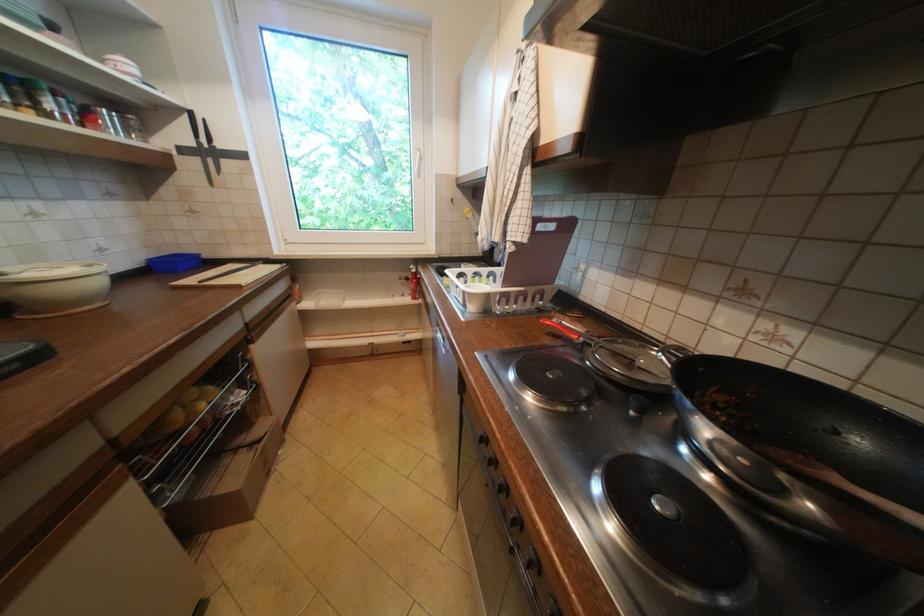
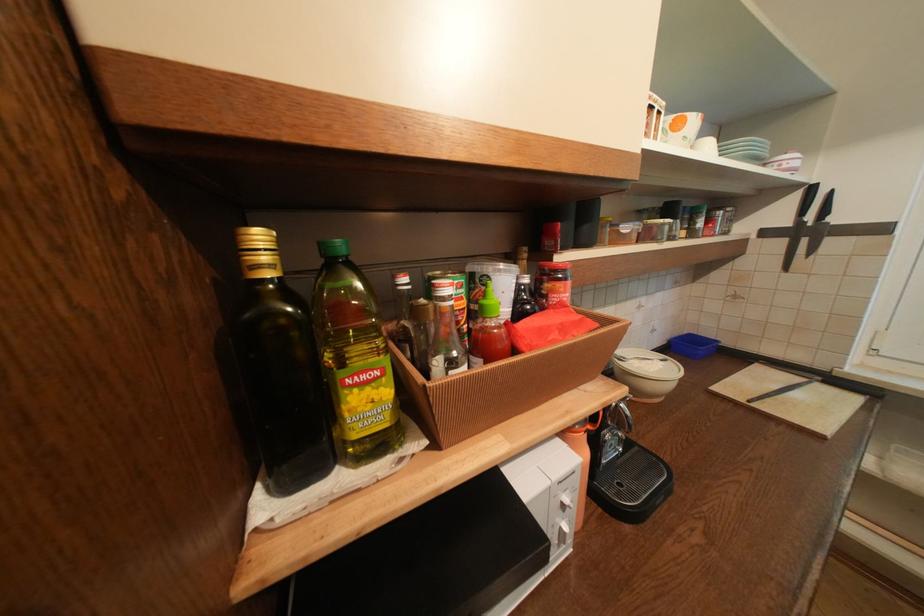
Find the pixel in the second image that matches point 92,270 in the first image.

(670, 363)